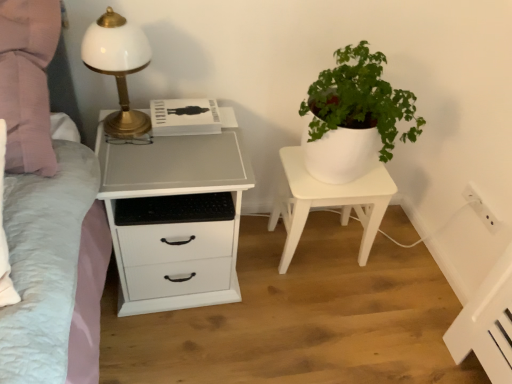
This screenshot has width=512, height=384. Identify the location of free space in front of white glossy table lamp at left. (135, 161).